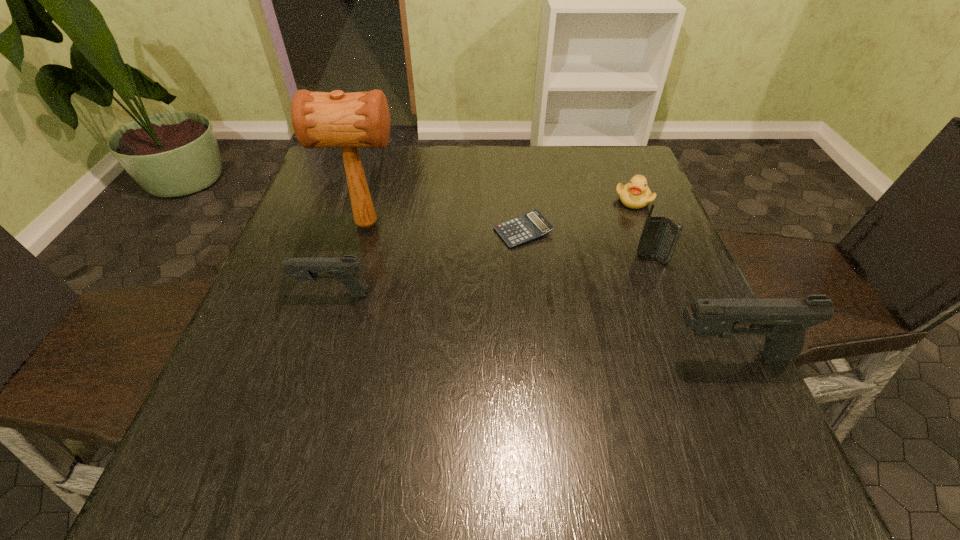
The height and width of the screenshot is (540, 960). In order to click on vacant space located at the barrel of the right pistol in this screenshot , I will do `click(585, 355)`.

Find the location of a particular element. Image resolution: width=960 pixels, height=540 pixels. vacant space located 0.250m at the barrel of the right pistol is located at coordinates (529, 355).

You are a GUI agent. You are given a task and a screenshot of the screen. Output one action in this format:
    pyautogui.click(x=<x>, y=<y>)
    Task: Click on the blank area located at the barrel of the right pistol
    The width and height of the screenshot is (960, 540).
    Given the screenshot: What is the action you would take?
    pyautogui.click(x=485, y=355)

Identify the location of vacant space situated 0.280m on the back of the fourth object from right to left. Image resolution: width=960 pixels, height=540 pixels. (516, 154).

Where is `vacant space situated on the keyboard of the third nearest object`? This screenshot has height=540, width=960. vacant space situated on the keyboard of the third nearest object is located at coordinates (705, 395).

I want to click on vacant point located on the strike surface of the tallest object, so click(539, 224).

Locate an element on the screen. This screenshot has width=960, height=540. free spot located 0.320m on the beak of the duckling is located at coordinates (678, 310).

Image resolution: width=960 pixels, height=540 pixels. I want to click on object located at the far edge, so click(636, 194).

Identify the location of pistol present at the left edge. (345, 269).

This screenshot has height=540, width=960. I want to click on mallet at the left edge, so click(x=320, y=119).